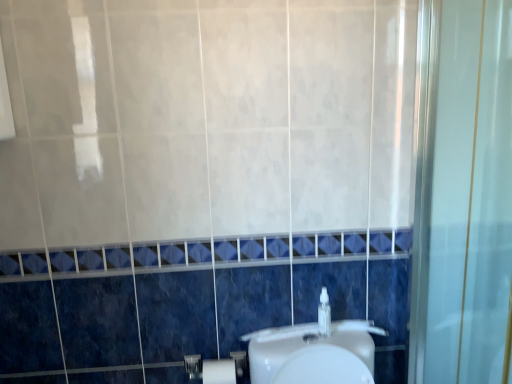
Question: Can you confirm if clear plastic bottle at center is thinner than white matte toilet paper at lower center?

Choices:
 (A) no
 (B) yes

Answer: (B)

Question: Would you say clear plastic bottle at center is outside white matte toilet paper at lower center?

Choices:
 (A) no
 (B) yes

Answer: (B)

Question: Are clear plastic bottle at center and white matte toilet paper at lower center beside each other?

Choices:
 (A) no
 (B) yes

Answer: (A)

Question: Could you tell me if clear plastic bottle at center is facing white matte toilet paper at lower center?

Choices:
 (A) no
 (B) yes

Answer: (A)

Question: Is white matte toilet paper at lower center completely or partially inside clear plastic bottle at center?

Choices:
 (A) yes
 (B) no

Answer: (B)

Question: Is clear plastic bottle at center closer to the viewer compared to white matte toilet paper at lower center?

Choices:
 (A) yes
 (B) no

Answer: (A)

Question: Does white matte toilet paper at lower center have a greater height compared to clear plastic bottle at center?

Choices:
 (A) yes
 (B) no

Answer: (A)

Question: From the image's perspective, would you say white matte toilet paper at lower center is positioned over clear plastic bottle at center?

Choices:
 (A) no
 (B) yes

Answer: (A)

Question: Is white matte toilet paper at lower center next to clear plastic bottle at center and touching it?

Choices:
 (A) yes
 (B) no

Answer: (B)

Question: Is clear plastic bottle at center inside white matte toilet paper at lower center?

Choices:
 (A) yes
 (B) no

Answer: (B)

Question: Is white matte toilet paper at lower center in front of clear plastic bottle at center?

Choices:
 (A) no
 (B) yes

Answer: (A)

Question: Can you confirm if white matte toilet paper at lower center is positioned to the right of clear plastic bottle at center?

Choices:
 (A) yes
 (B) no

Answer: (B)

Question: Is clear plastic bottle at center wider or thinner than white matte toilet paper at lower center?

Choices:
 (A) thin
 (B) wide

Answer: (A)